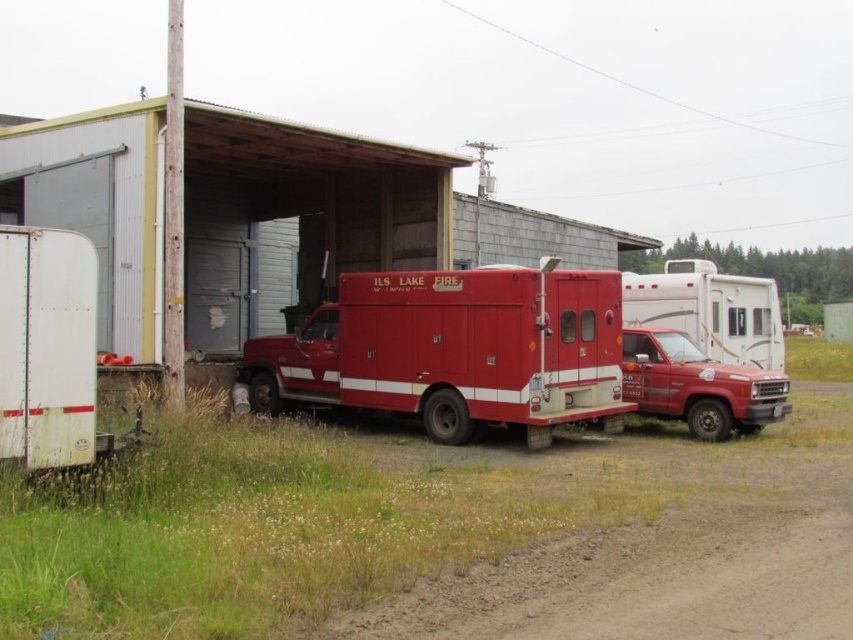
From the picture: Between metallic red fire truck at center and shiny red fire truck at center, which one is positioned lower?

Positioned lower is metallic red fire truck at center.

Where is `metallic red fire truck at center`? The width and height of the screenshot is (853, 640). metallic red fire truck at center is located at coordinates (386, 524).

Identify the location of metallic red fire truck at center. Image resolution: width=853 pixels, height=640 pixels. (386, 524).

Can you confirm if metallic red fire truck at center is positioned to the right of matte red fire truck at center?

Incorrect, metallic red fire truck at center is not on the right side of matte red fire truck at center.

Between metallic red fire truck at center and matte red fire truck at center, which one appears on the left side from the viewer's perspective?

From the viewer's perspective, metallic red fire truck at center appears more on the left side.

Find the location of a particular element. metallic red fire truck at center is located at coordinates (386, 524).

Find the location of a particular element. This screenshot has width=853, height=640. metallic red fire truck at center is located at coordinates (386, 524).

Who is taller, shiny red fire truck at center or matte red fire truck at center?

Standing taller between the two is matte red fire truck at center.

Does shiny red fire truck at center have a greater width compared to matte red fire truck at center?

In fact, shiny red fire truck at center might be narrower than matte red fire truck at center.

At what (x,y) coordinates should I click in order to perform the action: click on shiny red fire truck at center. Please return your answer as a coordinate pair (x, y). Image resolution: width=853 pixels, height=640 pixels. Looking at the image, I should click on (456, 349).